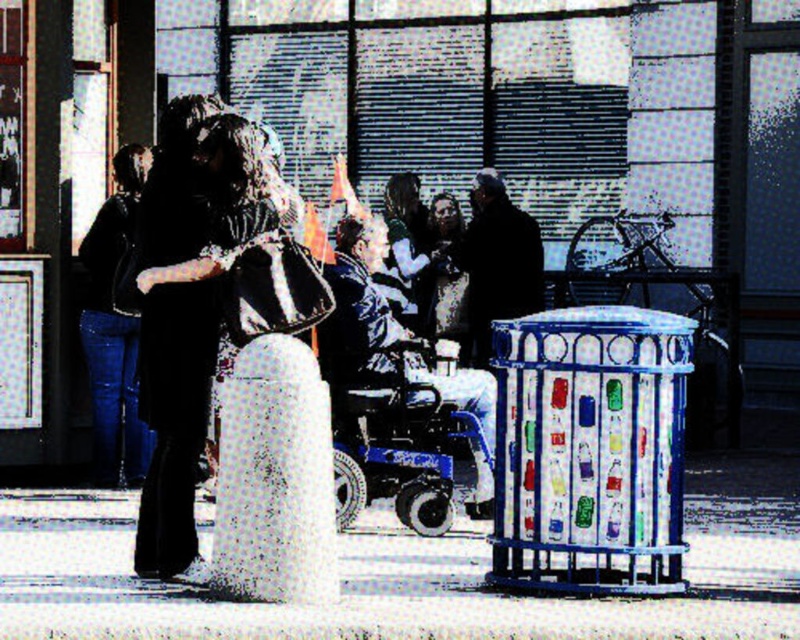
You are a delivery person trying to navigate through this street scene. You need to place a large package on the ground. Which area would you choose between the white concrete pavement at lower center and the black fabric dress at center, and why?

You should choose the white concrete pavement at lower center because its width is larger than the black fabric dress at center, providing a more stable and spacious area to place the large package.

You are navigating a delivery robot that must move from the starting point to the destination point. The starting point is at point (750, 531) and the destination is at point (412, 195). According to the scene, which direction should the robot move to reach the destination?

The robot should move backward because point (750, 531) is in front of point (412, 195), so to reach the destination, it needs to move in the opposite direction.

You are a fashion designer observing the scene. You notice the black fabric dress at center and the dark brown leather jacket at center. Which clothing item is positioned lower on the person?

The black fabric dress at center is below dark brown leather jacket at center, so the black fabric dress at center is positioned lower on the person.